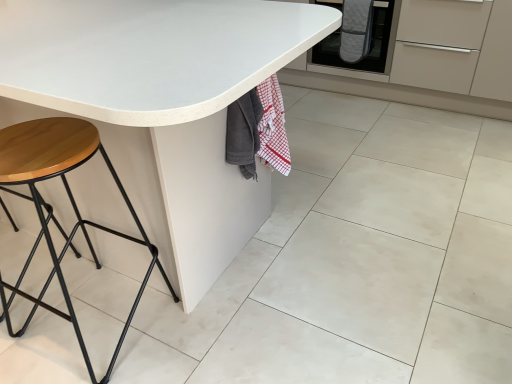
Question: Relative to white matte granite at center, is white matte table at center in front or behind?

Choices:
 (A) behind
 (B) front

Answer: (B)

Question: In terms of height, does white matte table at center look taller or shorter compared to white matte granite at center?

Choices:
 (A) short
 (B) tall

Answer: (B)

Question: Considering the real-world distances, which object is closest to the gray quilted blanket at upper right?

Choices:
 (A) quilted gray oven mitts at center
 (B) wooden/matte stool at left
 (C) white matte granite at center
 (D) gray quilted oven mitt at upper right
 (E) white matte table at center

Answer: (D)

Question: Which object is positioned closest to the quilted gray oven mitts at center?

Choices:
 (A) white matte granite at center
 (B) gray quilted blanket at upper right
 (C) wooden/matte stool at left
 (D) white matte table at center
 (E) gray quilted oven mitt at upper right

Answer: (E)